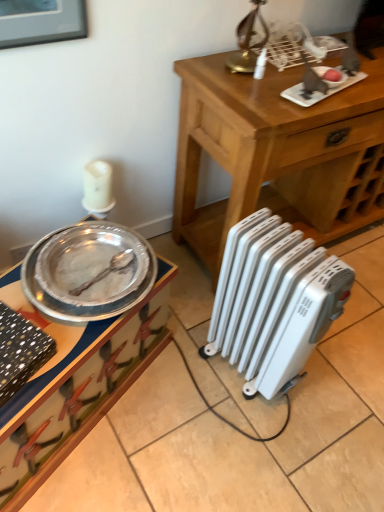
At what (x,y) coordinates should I click in order to perform the action: click on vacant area to the right of white plastic radiator at lower right. Please return your answer as a coordinate pair (x, y). Looking at the image, I should click on (337, 388).